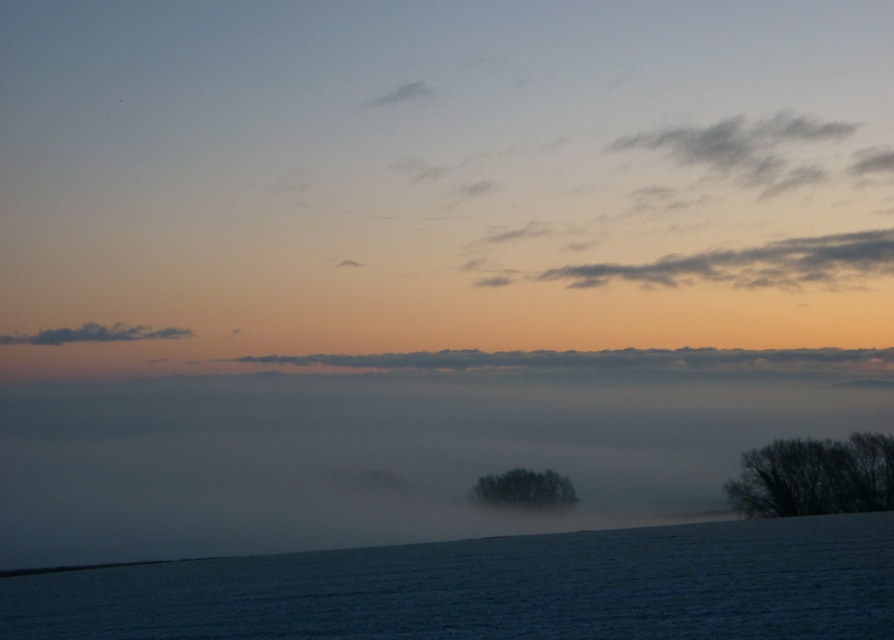
Looking at this image, which is more to the right, gray fluffy cloud at upper right or dark gray fluffy cloud at left?

gray fluffy cloud at upper right is more to the right.

Can you confirm if gray fluffy cloud at upper right is shorter than dark gray fluffy cloud at left?

No, gray fluffy cloud at upper right is not shorter than dark gray fluffy cloud at left.

Between point (677, 129) and point (98, 337), which one is positioned in front?

Point (98, 337) is more forward.

The width and height of the screenshot is (894, 640). In order to click on gray fluffy cloud at upper right in this screenshot , I will do click(x=743, y=147).

Is dark brown textured tree at right above gray fluffy cloud at upper right?

Incorrect, dark brown textured tree at right is not positioned above gray fluffy cloud at upper right.

Is dark brown textured tree at right taller than gray fluffy cloud at upper right?

No, dark brown textured tree at right is not taller than gray fluffy cloud at upper right.

Where is `dark brown textured tree at right`? dark brown textured tree at right is located at coordinates (814, 476).

Is point (774, 278) more distant than point (369, 108)?

That is False.

Is gray/cloudy sky at upper center wider than white fluffy cloud at upper center?

Correct, the width of gray/cloudy sky at upper center exceeds that of white fluffy cloud at upper center.

The image size is (894, 640). Describe the element at coordinates (740, 264) in the screenshot. I see `gray/cloudy sky at upper center` at that location.

Where is `gray/cloudy sky at upper center`? The height and width of the screenshot is (640, 894). gray/cloudy sky at upper center is located at coordinates (740, 264).